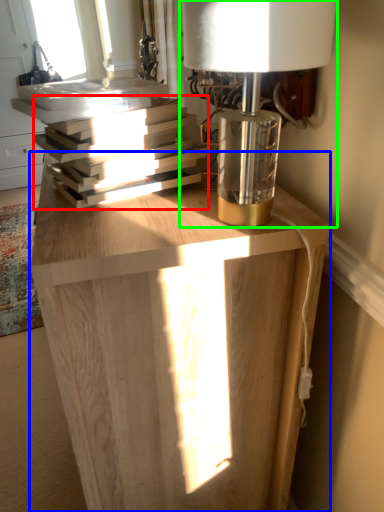
Question: Which is farther away from book (highlighted by a red box)? table (highlighted by a blue box) or lamp (highlighted by a green box)?

Choices:
 (A) table
 (B) lamp

Answer: (A)